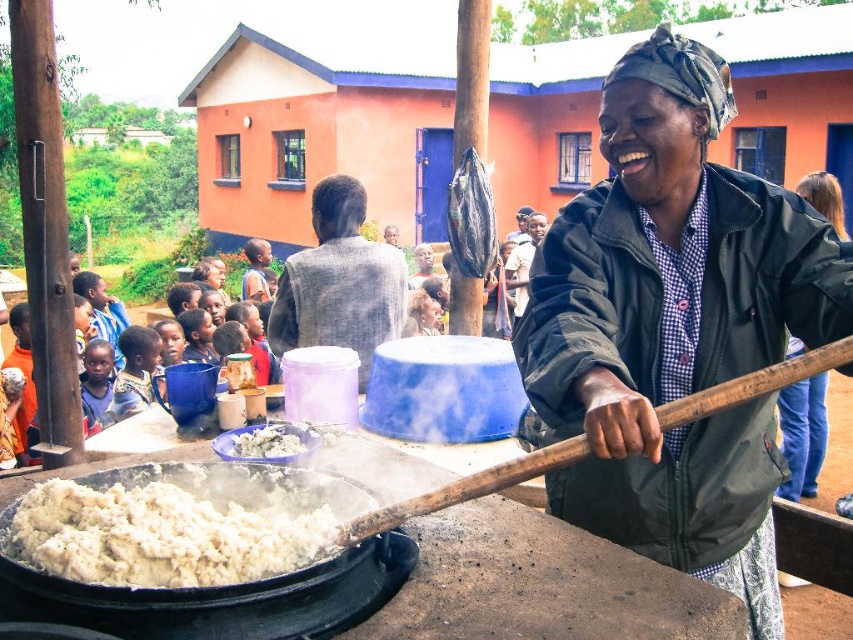
You are a photographer standing at the camera position. You want to take a photo of the white fluffy food at lower left. Can you reach it with your hand to adjust its position if you are 1.48 meters away?

The white fluffy food at lower left is 1.48 meters away from the camera. Since the average human arm length is about 0.7 meters, you cannot reach it with your hand from that distance.